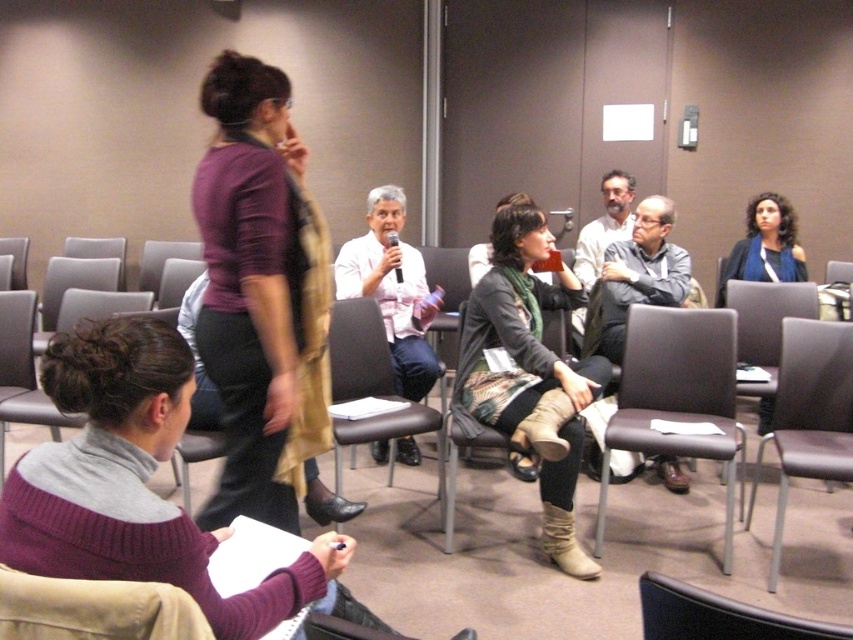
Does matte purple sweater at center appear over matte gray chair at left?

Actually, matte purple sweater at center is below matte gray chair at left.

Is point (260, 209) closer to viewer compared to point (22, 275)?

That is True.

Locate an element on the screen. The height and width of the screenshot is (640, 853). matte purple sweater at center is located at coordinates (262, 300).

Which is above, brown leather chair at lower right or beige fabric chair at lower left?

Positioned higher is beige fabric chair at lower left.

Is brown leather chair at lower right below beige fabric chair at lower left?

Yes.

Who is more distant from viewer, [821,467] or [120,584]?

Point [821,467]

The image size is (853, 640). What are the coordinates of `brown leather chair at lower right` in the screenshot? It's located at (808, 413).

Is point (550, 531) farther from viewer compared to point (67, 323)?

No.

Which is above, green scarf at center or brown leather chair at lower left?

green scarf at center

Find the location of a particular element. Image resolution: width=853 pixels, height=640 pixels. green scarf at center is located at coordinates (531, 372).